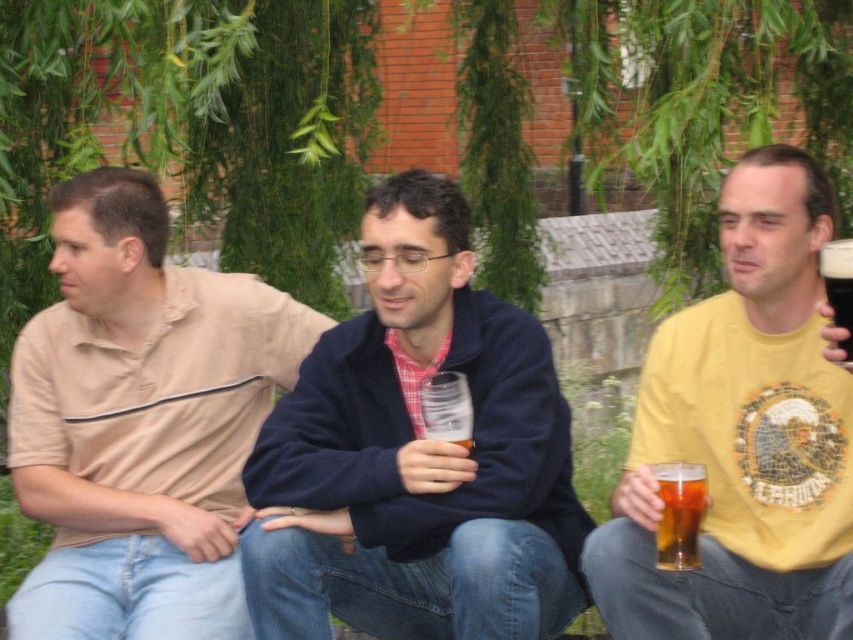
Question: Does matte blue jacket at center appear over beige cotton polo shirt at left?

Choices:
 (A) no
 (B) yes

Answer: (B)

Question: Which point is farther from the camera taking this photo?

Choices:
 (A) (315, 600)
 (B) (71, 552)
 (C) (676, 540)

Answer: (B)

Question: Among these objects, which one is farthest from the camera?

Choices:
 (A) matte blue jacket at center
 (B) amber glass beer at lower right
 (C) yellow printed t-shirt at right

Answer: (A)

Question: In this image, where is matte blue jacket at center located relative to dark brown glass at right?

Choices:
 (A) left
 (B) right

Answer: (A)

Question: Which of the following is the farthest from the observer?

Choices:
 (A) dark brown glass at right
 (B) beige cotton polo shirt at left

Answer: (B)

Question: Can you confirm if matte blue jacket at center is bigger than yellow printed t-shirt at right?

Choices:
 (A) no
 (B) yes

Answer: (B)